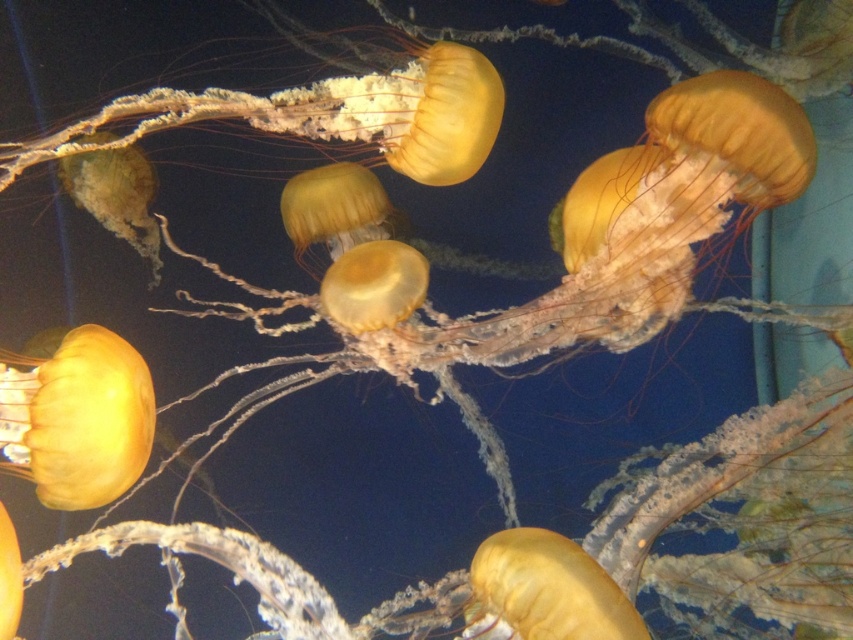
Question: Which object is the farthest from the translucent yellow jellyfish at bottom left?

Choices:
 (A) translucent yellow jellyfish at center
 (B) translucent yellow jellyfish at upper center

Answer: (B)

Question: Is translucent yellow jellyfish at center further to camera compared to translucent yellow jellyfish at upper center?

Choices:
 (A) no
 (B) yes

Answer: (B)

Question: Estimate the real-world distances between objects in this image. Which object is closer to the translucent yellow jellyfish at center?

Choices:
 (A) translucent yellow jellyfish at bottom left
 (B) translucent yellow jellyfish at upper center

Answer: (B)

Question: Can you confirm if translucent yellow jellyfish at center is smaller than translucent yellow jellyfish at upper center?

Choices:
 (A) no
 (B) yes

Answer: (A)

Question: Is translucent yellow jellyfish at upper center smaller than translucent yellow jellyfish at bottom left?

Choices:
 (A) yes
 (B) no

Answer: (B)

Question: Which object appears farthest from the camera in this image?

Choices:
 (A) translucent yellow jellyfish at bottom left
 (B) translucent yellow jellyfish at upper center

Answer: (B)